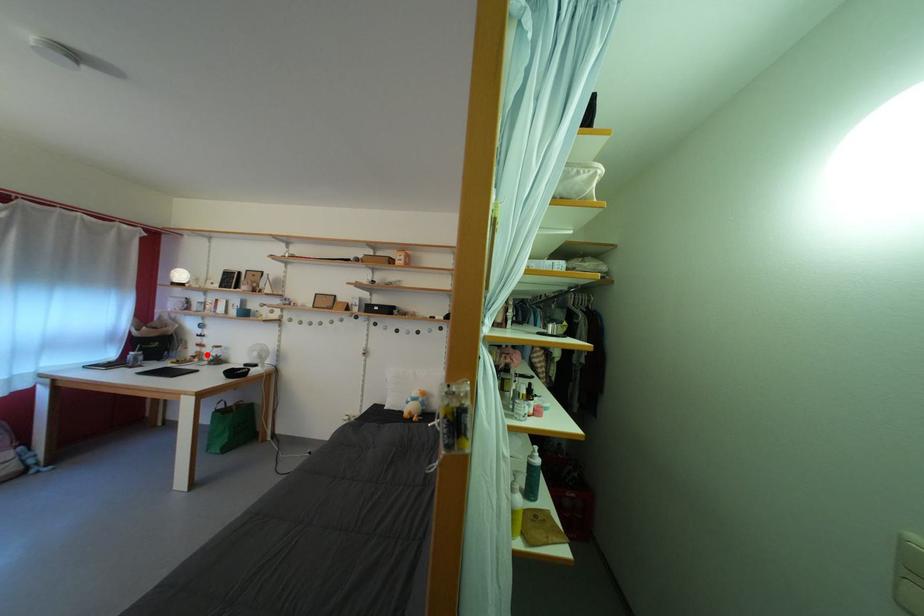
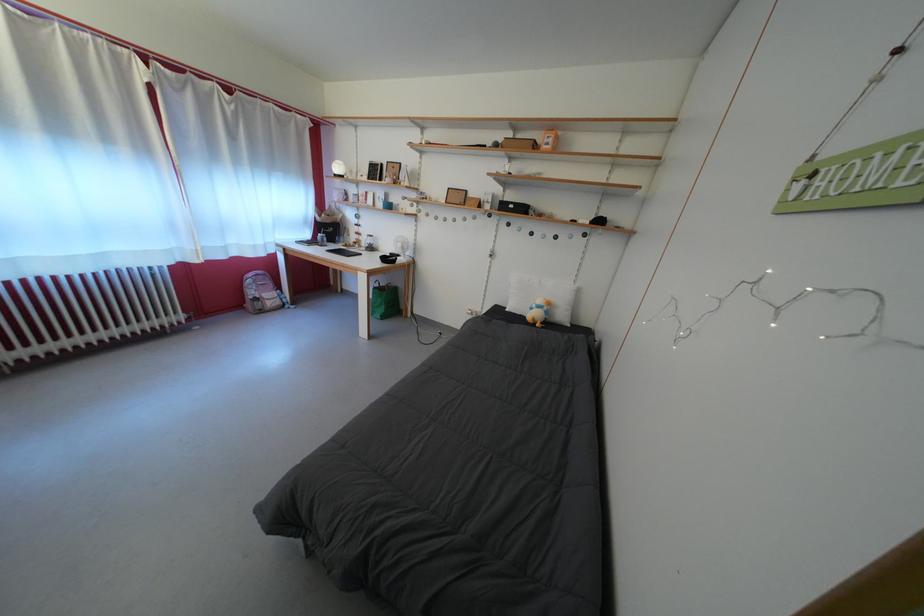
In the second image, find the point that corresponds to the highlighted location in the first image.

(365, 243)